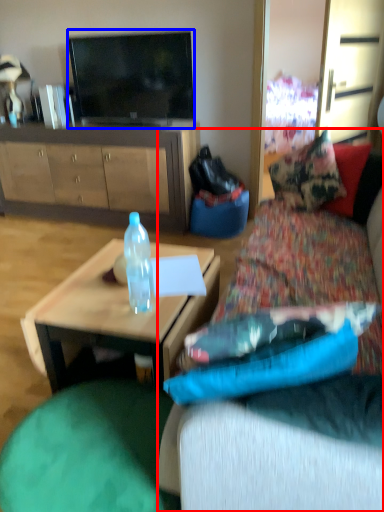
Question: Which object appears closest to the camera in this image, studio couch (highlighted by a red box) or television (highlighted by a blue box)?

Choices:
 (A) studio couch
 (B) television

Answer: (A)